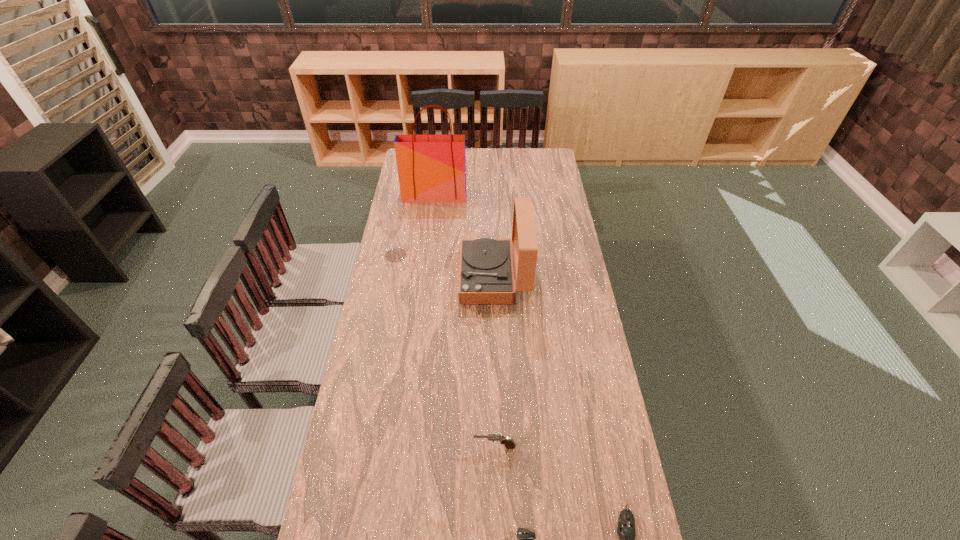
Locate an element on the screen. This screenshot has width=960, height=540. vacant space that's between the fifth shortest object and the third tallest object is located at coordinates tap(444, 266).

Locate an element on the screen. The image size is (960, 540). free space between the third tallest object and the fourth tallest object is located at coordinates (445, 351).

You are a GUI agent. You are given a task and a screenshot of the screen. Output one action in this format:
    pyautogui.click(x=<x>, y=<y>)
    Task: Click on the blank region between the pistol and the tallest object
    This screenshot has width=960, height=540.
    Given the screenshot: What is the action you would take?
    pyautogui.click(x=465, y=321)

This screenshot has height=540, width=960. What are the coordinates of `vacant space that is in between the flute glass and the fourth farthest object` in the screenshot? It's located at (445, 351).

The height and width of the screenshot is (540, 960). Find the location of `the closest object relative to the fifth tallest object`. the closest object relative to the fifth tallest object is located at coordinates (526, 537).

Locate an element on the screen. This screenshot has height=540, width=960. object that is the fifth nearest to the fourth shortest object is located at coordinates click(626, 523).